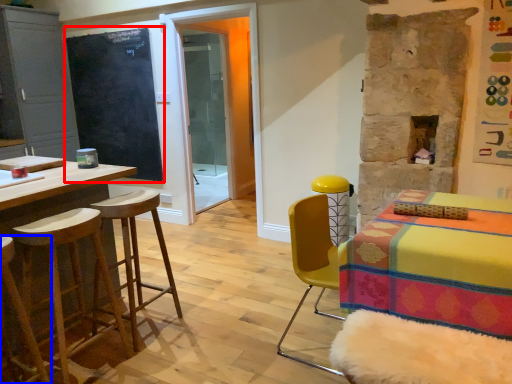
Question: Among these objects, which one is nearest to the camera, bulletin board (highlighted by a red box) or stool (highlighted by a blue box)?

Choices:
 (A) bulletin board
 (B) stool

Answer: (B)